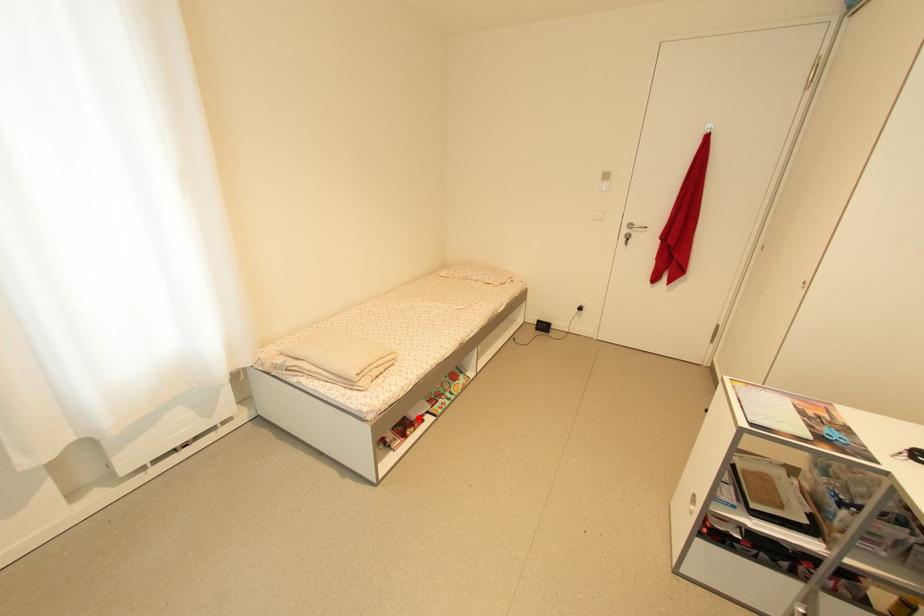
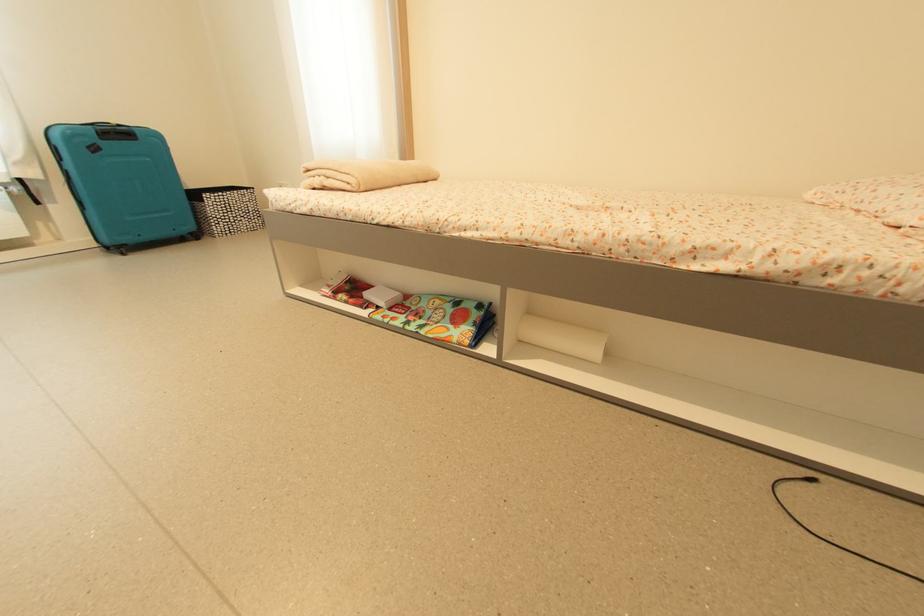
Question: I am providing you with two images of the same scene from different viewpoints. Image1 has a red point marked. In image2, the corresponding 3D location appears at what relative position? Reply with the corresponding letter.

Choices:
 (A) Closer
 (B) Farther

Answer: (B)